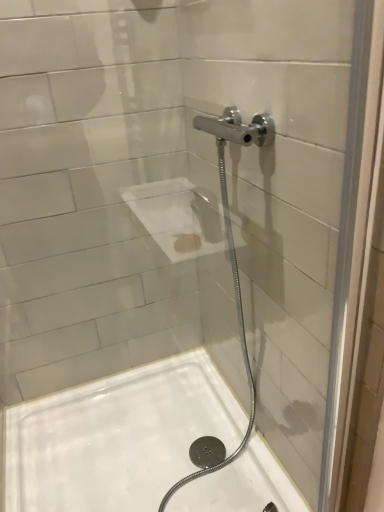
At what (x,y) coordinates should I click in order to perform the action: click on white glossy bath at lower left. Please return your answer as a coordinate pair (x, y). This screenshot has height=512, width=384. Looking at the image, I should click on (117, 437).

What do you see at coordinates (117, 437) in the screenshot?
I see `white glossy bath at lower left` at bounding box center [117, 437].

What is the approximate height of white glossy bath at lower left?

It is 4.31 inches.

This screenshot has height=512, width=384. What do you see at coordinates (286, 193) in the screenshot? I see `transparent glass door at upper center` at bounding box center [286, 193].

In order to click on transparent glass door at upper center in this screenshot , I will do `click(286, 193)`.

Locate an element on the screen. Image resolution: width=384 pixels, height=512 pixels. white glossy bath at lower left is located at coordinates (117, 437).

Considering the relative positions of white glossy bath at lower left and transparent glass door at upper center in the image provided, is white glossy bath at lower left to the left of transparent glass door at upper center from the viewer's perspective?

Indeed, white glossy bath at lower left is positioned on the left side of transparent glass door at upper center.

Between white glossy bath at lower left and transparent glass door at upper center, which one is positioned in front?

transparent glass door at upper center is in front.

Considering the points (42, 499) and (315, 207), which point is behind, point (42, 499) or point (315, 207)?

The point (42, 499) is farther.

From the image's perspective, between white glossy bath at lower left and transparent glass door at upper center, which one is located above?

transparent glass door at upper center is shown above in the image.

From a real-world perspective, which is physically above, white glossy bath at lower left or transparent glass door at upper center?

From a 3D spatial view, transparent glass door at upper center is above.

Considering the sizes of white glossy bath at lower left and transparent glass door at upper center in the image, is white glossy bath at lower left wider or thinner than transparent glass door at upper center?

white glossy bath at lower left is wider than transparent glass door at upper center.

Which of these two, white glossy bath at lower left or transparent glass door at upper center, stands taller?

With more height is transparent glass door at upper center.

Which of these two, white glossy bath at lower left or transparent glass door at upper center, is bigger?

white glossy bath at lower left is bigger.

Is white glossy bath at lower left positioned beyond the bounds of transparent glass door at upper center?

Yes, white glossy bath at lower left is located beyond the bounds of transparent glass door at upper center.

Is white glossy bath at lower left placed right next to transparent glass door at upper center?

white glossy bath at lower left and transparent glass door at upper center are clearly separated.

Is white glossy bath at lower left looking in the opposite direction of transparent glass door at upper center?

No, white glossy bath at lower left's orientation is not away from transparent glass door at upper center.

How much distance is there between white glossy bath at lower left and transparent glass door at upper center?

They are 20.39 inches apart.

You are a GUI agent. You are given a task and a screenshot of the screen. Output one action in this format:
    pyautogui.click(x=<x>, y=<y>)
    Task: Click on the bath that appears on the left of transparent glass door at upper center
    The width and height of the screenshot is (384, 512).
    Given the screenshot: What is the action you would take?
    pyautogui.click(x=117, y=437)

Is transparent glass door at upper center to the left or to the right of white glossy bath at lower left in the image?

transparent glass door at upper center is to the right of white glossy bath at lower left.

Which object is closer to the camera, transparent glass door at upper center or white glossy bath at lower left?

transparent glass door at upper center is closer to the camera.

Is point (220, 335) more distant than point (174, 510)?

Yes, point (220, 335) is behind point (174, 510).

From the image's perspective, does transparent glass door at upper center appear lower than white glossy bath at lower left?

Actually, transparent glass door at upper center appears above white glossy bath at lower left in the image.

From a real-world perspective, who is located higher, transparent glass door at upper center or white glossy bath at lower left?

transparent glass door at upper center is physically above.

Considering the sizes of objects transparent glass door at upper center and white glossy bath at lower left in the image provided, who is thinner, transparent glass door at upper center or white glossy bath at lower left?

Thinner between the two is transparent glass door at upper center.

Considering the sizes of objects transparent glass door at upper center and white glossy bath at lower left in the image provided, who is shorter, transparent glass door at upper center or white glossy bath at lower left?

white glossy bath at lower left.

Considering the relative sizes of transparent glass door at upper center and white glossy bath at lower left in the image provided, is transparent glass door at upper center smaller than white glossy bath at lower left?

Indeed, transparent glass door at upper center has a smaller size compared to white glossy bath at lower left.

Is transparent glass door at upper center completely or partially outside of white glossy bath at lower left?

Indeed, transparent glass door at upper center is completely outside white glossy bath at lower left.

Would you consider transparent glass door at upper center to be distant from white glossy bath at lower left?

transparent glass door at upper center is actually quite close to white glossy bath at lower left.

Is transparent glass door at upper center facing away from white glossy bath at lower left?

Correct, transparent glass door at upper center is looking away from white glossy bath at lower left.

In the scene shown: How many degrees apart are the facing directions of transparent glass door at upper center and white glossy bath at lower left?

transparent glass door at upper center and white glossy bath at lower left are facing 0.18 degrees away from each other.

How much distance is there between transparent glass door at upper center and white glossy bath at lower left?

20.39 inches.

In order to click on bath below the transparent glass door at upper center (from the image's perspective) in this screenshot , I will do `click(117, 437)`.

The height and width of the screenshot is (512, 384). In order to click on glass door above the white glossy bath at lower left (from the image's perspective) in this screenshot , I will do `click(286, 193)`.

Where is `glass door on the right of white glossy bath at lower left`? This screenshot has width=384, height=512. glass door on the right of white glossy bath at lower left is located at coordinates (286, 193).